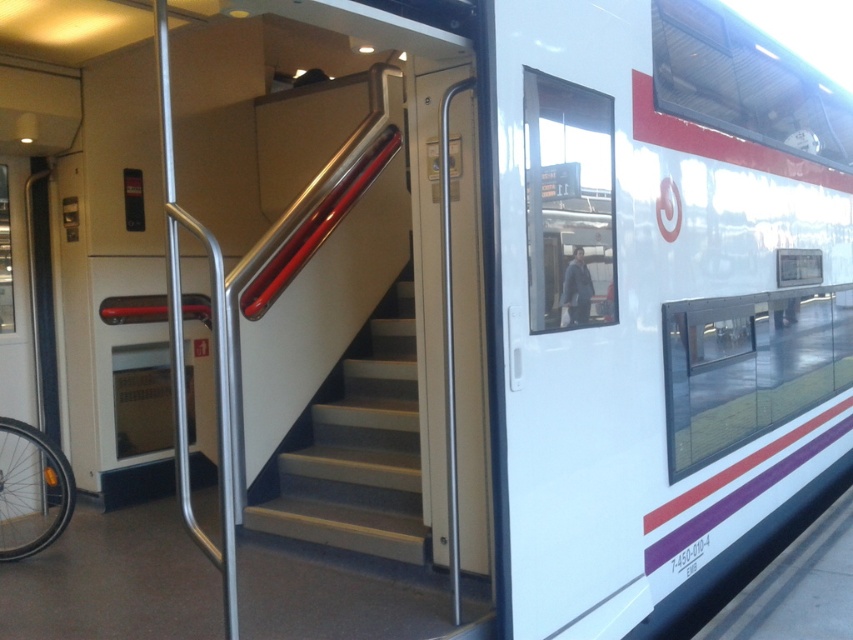
Question: Can you confirm if white matte stairs at center is wider than silver metallic bicycle wheel at lower left?

Choices:
 (A) yes
 (B) no

Answer: (A)

Question: Which point is closer to the camera?

Choices:
 (A) (59, 474)
 (B) (294, 467)

Answer: (A)

Question: Is white matte stairs at center smaller than silver metallic bicycle wheel at lower left?

Choices:
 (A) yes
 (B) no

Answer: (B)

Question: Can you confirm if white matte stairs at center is wider than silver metallic bicycle wheel at lower left?

Choices:
 (A) yes
 (B) no

Answer: (A)

Question: Which point is closer to the camera?

Choices:
 (A) white matte stairs at center
 (B) silver metallic bicycle wheel at lower left

Answer: (A)